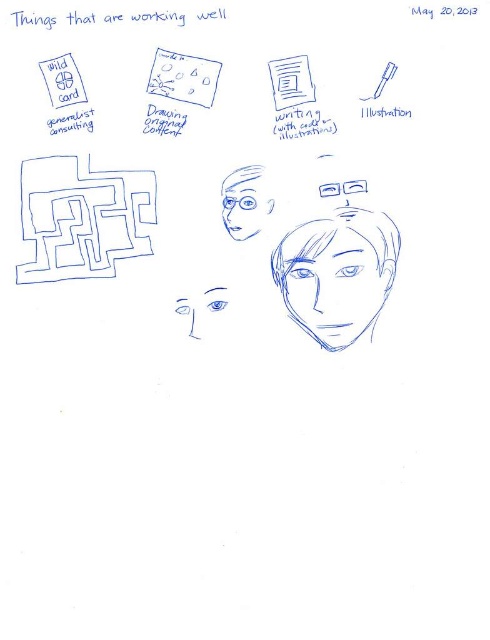
You are a photographer preparing to take a portrait of a person wearing blue matte glasses at center and has a smooth skin face at center. You want to ensure the subject looks natural. Which object should you focus on more to achieve this?

The smooth skin face at center is taller than blue matte glasses at center, so focusing on the smooth skin face at center will help achieve a natural look since it occupies a larger portion of the frame.

Based on the coordinates provided, which object is located at point (x=82, y=218)?

The blue line art maze at upper left is located at point (x=82, y=218).